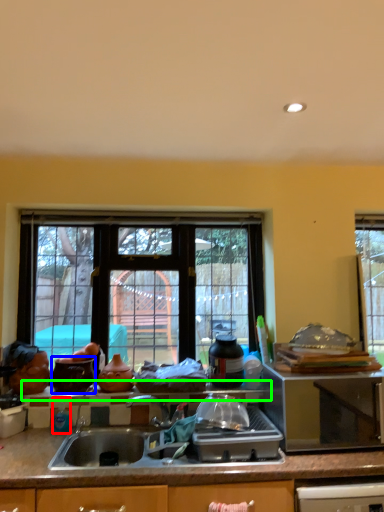
Question: Which object is positioned closest to bottle (highlighted by a red box)? Select from appliance (highlighted by a blue box) and window sill (highlighted by a green box).

Choices:
 (A) appliance
 (B) window sill

Answer: (A)